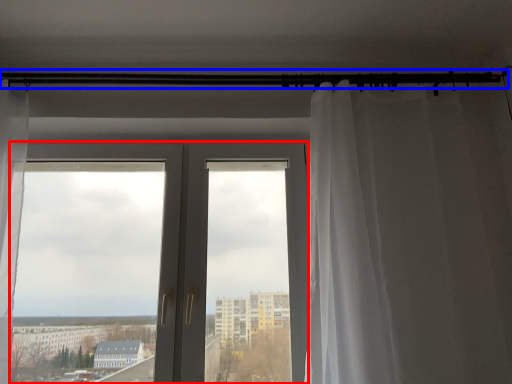
Question: Among these objects, which one is nearest to the camera, door (highlighted by a red box) or beam (highlighted by a blue box)?

Choices:
 (A) door
 (B) beam

Answer: (A)